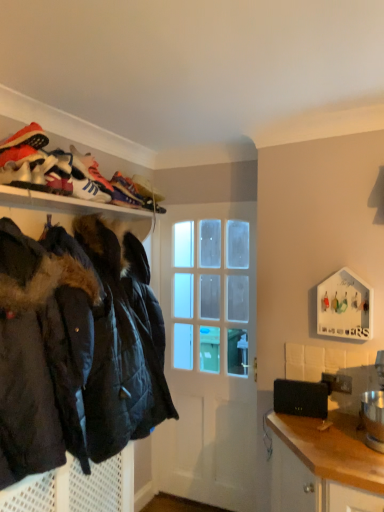
Question: Is black matte laptop at lower right facing away from black quilted jacket at left?

Choices:
 (A) no
 (B) yes

Answer: (A)

Question: Does black matte laptop at lower right come behind black quilted jacket at left?

Choices:
 (A) no
 (B) yes

Answer: (B)

Question: From a real-world perspective, is black matte laptop at lower right located higher than black quilted jacket at left?

Choices:
 (A) no
 (B) yes

Answer: (A)

Question: Would you say black matte laptop at lower right is a long distance from black quilted jacket at left?

Choices:
 (A) yes
 (B) no

Answer: (B)

Question: Does black matte laptop at lower right have a lesser height compared to black quilted jacket at left?

Choices:
 (A) no
 (B) yes

Answer: (B)

Question: From their relative heights in the image, would you say black matte laptop at lower right is taller or shorter than matte black jackets at upper left?

Choices:
 (A) short
 (B) tall

Answer: (A)

Question: Looking at the image, does black matte laptop at lower right seem bigger or smaller compared to matte black jackets at upper left?

Choices:
 (A) small
 (B) big

Answer: (A)

Question: From a real-world perspective, is black matte laptop at lower right physically located above or below matte black jackets at upper left?

Choices:
 (A) below
 (B) above

Answer: (A)

Question: Is point (292, 385) closer or farther from the camera than point (9, 202)?

Choices:
 (A) farther
 (B) closer

Answer: (A)

Question: Is black quilted jacket at left spatially inside black quilted jacket at lower left, or outside of it?

Choices:
 (A) outside
 (B) inside

Answer: (A)

Question: Does point (4, 430) appear closer or farther from the camera than point (107, 468)?

Choices:
 (A) closer
 (B) farther

Answer: (A)

Question: Is black quilted jacket at left wider or thinner than black quilted jacket at lower left?

Choices:
 (A) thin
 (B) wide

Answer: (B)

Question: Considering the positions of black quilted jacket at left and black quilted jacket at lower left in the image, is black quilted jacket at left taller or shorter than black quilted jacket at lower left?

Choices:
 (A) short
 (B) tall

Answer: (B)

Question: Based on their sizes in the image, would you say black quilted jacket at left is bigger or smaller than white glossy door at center?

Choices:
 (A) small
 (B) big

Answer: (B)

Question: Is black quilted jacket at left wider or thinner than white glossy door at center?

Choices:
 (A) thin
 (B) wide

Answer: (B)